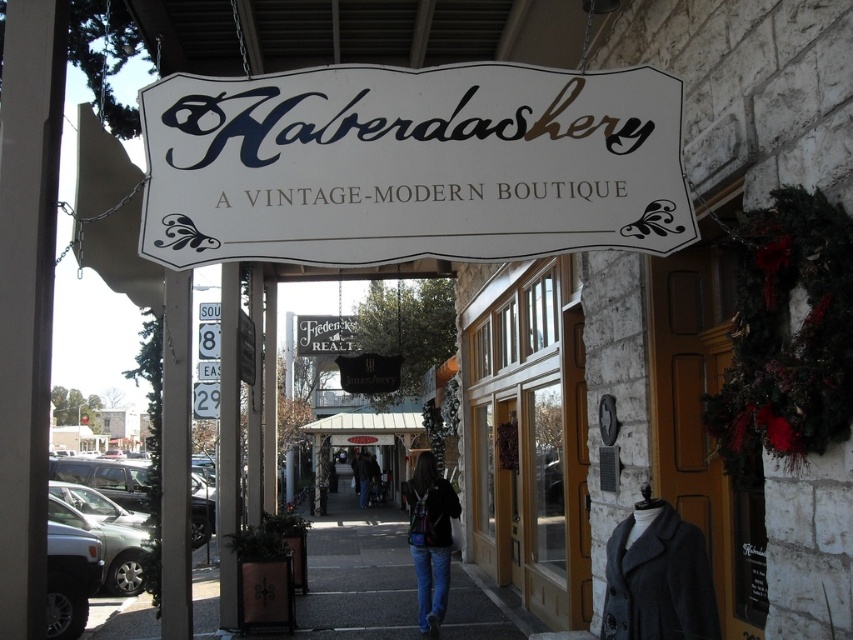
Is dark brown leather jacket at center thinner than denim jacket at center?

Correct, dark brown leather jacket at center's width is less than denim jacket at center's.

Identify the location of dark brown leather jacket at center. (430, 538).

Identify the location of dark brown leather jacket at center. The width and height of the screenshot is (853, 640). (430, 538).

Can you confirm if white paper sign at center is positioned to the left of gray concrete sidewalk at center?

Incorrect, white paper sign at center is not on the left side of gray concrete sidewalk at center.

Is point (141, 115) in front of point (351, 628)?

Yes, it is.

The image size is (853, 640). I want to click on white paper sign at center, so click(410, 164).

Who is taller, white paper sign at center or dark brown leather jacket at center?

Standing taller between the two is white paper sign at center.

Between white paper sign at center and dark brown leather jacket at center, which one is positioned lower?

Positioned lower is dark brown leather jacket at center.

Between point (310, 131) and point (456, 508), which one is positioned behind?

Point (456, 508)

Locate an element on the screen. white paper sign at center is located at coordinates (410, 164).